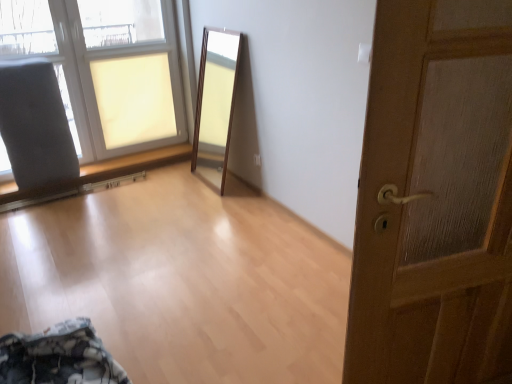
Question: From the image's perspective, is wooden door at right on gray fabric armchair at left?

Choices:
 (A) yes
 (B) no

Answer: (B)

Question: From the image's perspective, would you say wooden door at right is shown under gray fabric armchair at left?

Choices:
 (A) no
 (B) yes

Answer: (B)

Question: Is wooden door at right bigger than gray fabric armchair at left?

Choices:
 (A) yes
 (B) no

Answer: (A)

Question: Considering the relative sizes of wooden door at right and gray fabric armchair at left in the image provided, is wooden door at right thinner than gray fabric armchair at left?

Choices:
 (A) no
 (B) yes

Answer: (B)

Question: Is wooden door at right shorter than gray fabric armchair at left?

Choices:
 (A) yes
 (B) no

Answer: (B)

Question: From a real-world perspective, is wooden door at right above or below matte glass window at upper left?

Choices:
 (A) below
 (B) above

Answer: (B)

Question: Considering their positions, is wooden door at right located in front of or behind matte glass window at upper left?

Choices:
 (A) front
 (B) behind

Answer: (A)

Question: In terms of size, does wooden door at right appear bigger or smaller than matte glass window at upper left?

Choices:
 (A) big
 (B) small

Answer: (B)

Question: In terms of width, does wooden door at right look wider or thinner when compared to matte glass window at upper left?

Choices:
 (A) wide
 (B) thin

Answer: (B)

Question: From their relative heights in the image, would you say matte glass window at upper left is taller or shorter than wooden door at right?

Choices:
 (A) tall
 (B) short

Answer: (B)

Question: In terms of size, does matte glass window at upper left appear bigger or smaller than wooden door at right?

Choices:
 (A) small
 (B) big

Answer: (B)

Question: From the image's perspective, is matte glass window at upper left above or below wooden door at right?

Choices:
 (A) below
 (B) above

Answer: (B)

Question: In the image, is matte glass window at upper left positioned in front of or behind wooden door at right?

Choices:
 (A) front
 (B) behind

Answer: (B)

Question: Is wooden door at right bigger or smaller than gray fabric armchair at left?

Choices:
 (A) small
 (B) big

Answer: (B)

Question: From a real-world perspective, relative to gray fabric armchair at left, is wooden door at right vertically above or below?

Choices:
 (A) above
 (B) below

Answer: (A)